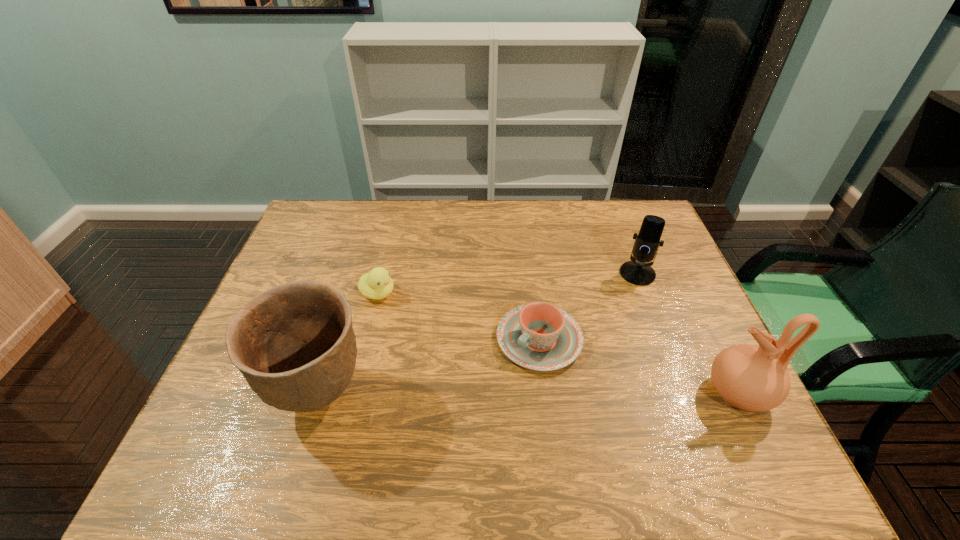
At what (x,y) coordinates should I click in order to perform the action: click on vacant point located on the stand of the microphone. Please return your answer as a coordinate pair (x, y). This screenshot has width=960, height=540. Looking at the image, I should click on (612, 304).

This screenshot has width=960, height=540. I want to click on free space located on the stand of the microphone, so click(577, 347).

Where is `free space located 0.340m on the stand of the microphone`? The height and width of the screenshot is (540, 960). free space located 0.340m on the stand of the microphone is located at coordinates 570,355.

At what (x,y) coordinates should I click in order to perform the action: click on vacant position located at the beak of the duckling. Please return your answer as a coordinate pair (x, y). This screenshot has width=960, height=540. Looking at the image, I should click on (454, 331).

I want to click on free spot located 0.100m at the beak of the duckling, so click(x=419, y=313).

The width and height of the screenshot is (960, 540). Identify the location of free space located 0.330m at the beak of the duckling. (490, 348).

At what (x,y) coordinates should I click in order to perform the action: click on free space located 0.110m on the handle side of the third object from right to left. Please return your answer as a coordinate pair (x, y). Looking at the image, I should click on (481, 393).

Locate an element on the screen. vacant point located 0.050m on the handle side of the third object from right to left is located at coordinates (498, 377).

The height and width of the screenshot is (540, 960). I want to click on vacant space located 0.150m on the handle side of the third object from right to left, so (x=469, y=404).

Identify the location of object at the left edge. Image resolution: width=960 pixels, height=540 pixels. (294, 343).